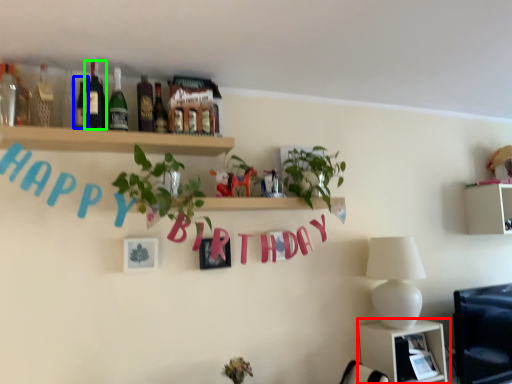
Question: Which object is positioned closest to shelf (highlighted by a red box)? Select from bottle (highlighted by a blue box) and bottle (highlighted by a green box).

Choices:
 (A) bottle
 (B) bottle

Answer: (B)